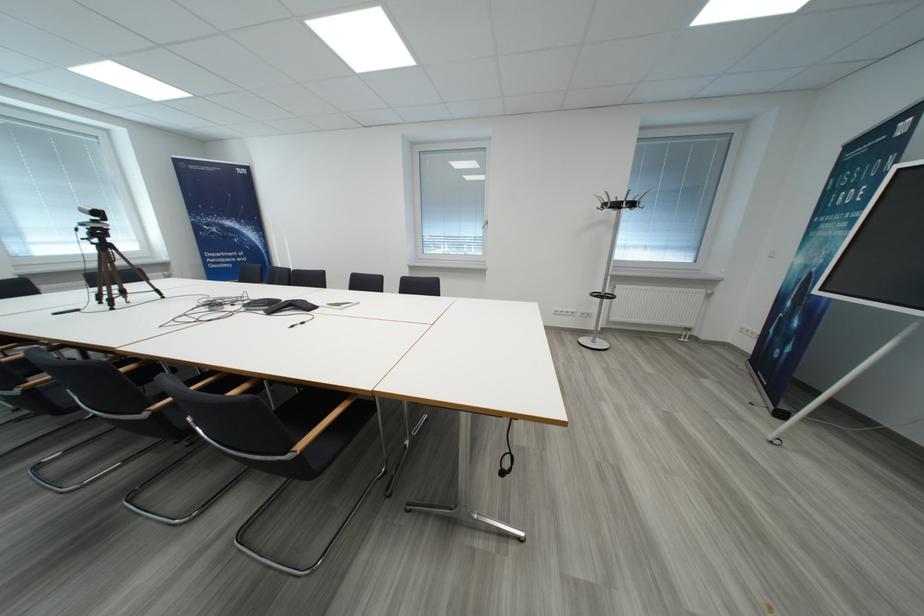
Locate an element on the screen. The image size is (924, 616). umbrella stand ring is located at coordinates 619,205.